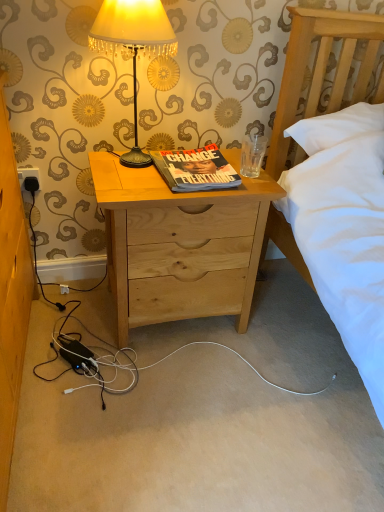
Measure the distance between point (166, 15) and camera.

They are 1.39 meters apart.

Describe the element at coordinates (133, 46) in the screenshot. This screenshot has height=512, width=384. I see `metallic lampshade at upper center` at that location.

What is the approximate width of hardcover book at center?

hardcover book at center is 11.71 inches in width.

In order to click on black plastic power outlet at lower left in this screenshot , I will do `click(29, 178)`.

What are the coordinates of `book below the metallic lampshade at upper center (from a real-world perspective)` in the screenshot? It's located at (195, 169).

Is metallic lampshade at upper center taller or shorter than hardcover book at center?

In the image, metallic lampshade at upper center appears to be taller than hardcover book at center.

Is metallic lampshade at upper center positioned far away from hardcover book at center?

metallic lampshade at upper center is near hardcover book at center, not far away.

Based on their positions, is black plastic power outlet at lower left located to the left or right of natural wood nightstand at center?

black plastic power outlet at lower left is to the left of natural wood nightstand at center.

From the image's perspective, is black plastic power outlet at lower left located above natural wood nightstand at center?

Correct, black plastic power outlet at lower left appears higher than natural wood nightstand at center in the image.

Looking at the image, does black plastic power outlet at lower left seem bigger or smaller compared to natural wood nightstand at center?

black plastic power outlet at lower left is smaller than natural wood nightstand at center.

Could you tell me if black plastic power outlet at lower left is facing natural wood nightstand at center?

No, black plastic power outlet at lower left does not turn towards natural wood nightstand at center.

Is hardcover book at center positioned beyond the bounds of natural wood nightstand at center?

Indeed, hardcover book at center is completely outside natural wood nightstand at center.

Looking at this image, can you see hardcover book at center touching natural wood nightstand at center?

No, hardcover book at center is not with natural wood nightstand at center.

Does hardcover book at center turn towards natural wood nightstand at center?

No, hardcover book at center does not turn towards natural wood nightstand at center.

Is metallic lampshade at upper center turned away from natural wood nightstand at center?

metallic lampshade at upper center does not have its back to natural wood nightstand at center.

Is there a large distance between metallic lampshade at upper center and natural wood nightstand at center?

No, there isn't a large distance between metallic lampshade at upper center and natural wood nightstand at center.

How distant is metallic lampshade at upper center from natural wood nightstand at center?

metallic lampshade at upper center is 34.33 centimeters away from natural wood nightstand at center.

How many degrees apart are the facing directions of metallic lampshade at upper center and natural wood nightstand at center?

The angle between the facing direction of metallic lampshade at upper center and the facing direction of natural wood nightstand at center is 0.79 degrees.

Can you tell me how much natural wood nightstand at center and black plastic power outlet at lower left differ in facing direction?

The angular difference between natural wood nightstand at center and black plastic power outlet at lower left is 0.95 degrees.

Which object is more forward, natural wood nightstand at center or black plastic power outlet at lower left?

natural wood nightstand at center is closer to the camera.

Find the location of a particular element. power outlet located behind the natural wood nightstand at center is located at coordinates (29, 178).

Which point is more distant from viewer, (x=24, y=185) or (x=90, y=33)?

The point (x=24, y=185) is farther.

From a real-world perspective, does black plastic power outlet at lower left sit lower than metallic lampshade at upper center?

Yes, from a real-world perspective, black plastic power outlet at lower left is beneath metallic lampshade at upper center.

Is black plastic power outlet at lower left turned away from metallic lampshade at upper center?

That's not correct — black plastic power outlet at lower left is not looking away from metallic lampshade at upper center.

Between metallic lampshade at upper center and black plastic power outlet at lower left, which one appears on the right side from the viewer's perspective?

metallic lampshade at upper center is more to the right.

Is metallic lampshade at upper center in front of black plastic power outlet at lower left?

Yes, the depth of metallic lampshade at upper center is less than that of black plastic power outlet at lower left.

Is metallic lampshade at upper center wider or thinner than black plastic power outlet at lower left?

In the image, metallic lampshade at upper center appears to be wider than black plastic power outlet at lower left.

Looking at this image, does metallic lampshade at upper center have a lesser height compared to black plastic power outlet at lower left?

No, metallic lampshade at upper center is not shorter than black plastic power outlet at lower left.

Where is `lamp above the hardcover book at center (from a real-world perspective)`? lamp above the hardcover book at center (from a real-world perspective) is located at coordinates (133, 46).

You are a GUI agent. You are given a task and a screenshot of the screen. Output one action in this format:
    pyautogui.click(x=<x>, y=<y>)
    Task: Click on the power outlet above the natural wood nightstand at center (from the image's perspective)
    The height and width of the screenshot is (512, 384).
    Given the screenshot: What is the action you would take?
    pyautogui.click(x=29, y=178)

Estimate the real-world distances between objects in this image. Which object is closer to hardcover book at center, black plastic power outlet at lower left or metallic lampshade at upper center?

metallic lampshade at upper center lies closer to hardcover book at center than the other object.

Which object lies nearer to the anchor point metallic lampshade at upper center, hardcover book at center or natural wood nightstand at center?

hardcover book at center is closer to metallic lampshade at upper center.

Based on their spatial positions, is hardcover book at center or metallic lampshade at upper center further from black plastic power outlet at lower left?

Among the two, hardcover book at center is located further to black plastic power outlet at lower left.

When comparing their distances from black plastic power outlet at lower left, does natural wood nightstand at center or hardcover book at center seem further?

natural wood nightstand at center is positioned further to the anchor black plastic power outlet at lower left.

When comparing their distances from black plastic power outlet at lower left, does natural wood nightstand at center or metallic lampshade at upper center seem closer?

metallic lampshade at upper center is closer to black plastic power outlet at lower left.

Looking at this image, looking at the image, which one is located closer to black plastic power outlet at lower left, metallic lampshade at upper center or hardcover book at center?

metallic lampshade at upper center is closer to black plastic power outlet at lower left.

When comparing their distances from natural wood nightstand at center, does hardcover book at center or black plastic power outlet at lower left seem closer?

hardcover book at center.

Based on their spatial positions, is metallic lampshade at upper center or natural wood nightstand at center further from black plastic power outlet at lower left?

natural wood nightstand at center is positioned further to the anchor black plastic power outlet at lower left.

The height and width of the screenshot is (512, 384). Find the location of `lamp between black plastic power outlet at lower left and hardcover book at center in the horizontal direction`. lamp between black plastic power outlet at lower left and hardcover book at center in the horizontal direction is located at coordinates 133,46.

Locate an element on the screen. This screenshot has width=384, height=512. desk situated between black plastic power outlet at lower left and hardcover book at center from left to right is located at coordinates (179, 245).

Where is `book that lies between metallic lampshade at upper center and natural wood nightstand at center from top to bottom`? This screenshot has width=384, height=512. book that lies between metallic lampshade at upper center and natural wood nightstand at center from top to bottom is located at coordinates (195, 169).

Identify the location of lamp located between black plastic power outlet at lower left and natural wood nightstand at center in the left-right direction. (133, 46).